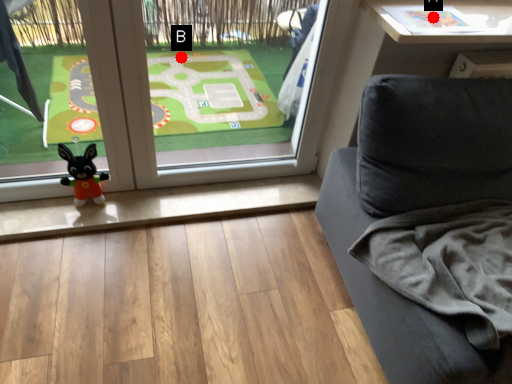
Question: Two points are circled on the image, labeled by A and B beside each circle. Among these points, which one is farthest from the camera?

Choices:
 (A) A is further
 (B) B is further

Answer: (B)